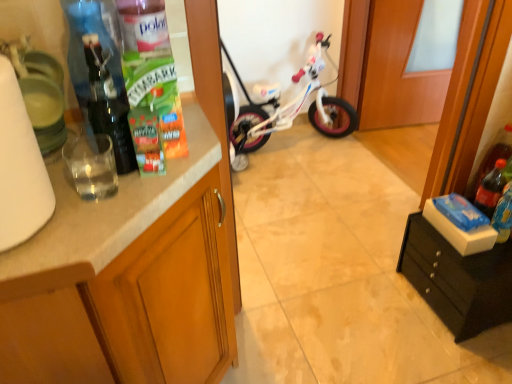
What is the approximate height of wooden door at center?

wooden door at center is 79.51 centimeters in height.

This screenshot has width=512, height=384. I want to click on wooden door at center, so click(x=398, y=71).

What is the approximate height of translucent plastic soda bottle at right, marked as the 2th bottle in a front-to-back arrangement?

translucent plastic soda bottle at right, marked as the 2th bottle in a front-to-back arrangement, is 24.81 centimeters tall.

The width and height of the screenshot is (512, 384). What do you see at coordinates (152, 70) in the screenshot? I see `clear plastic bottle at upper left, the 3th bottle viewed from the right` at bounding box center [152, 70].

Image resolution: width=512 pixels, height=384 pixels. What do you see at coordinates (106, 215) in the screenshot?
I see `white marble countertop at left` at bounding box center [106, 215].

Find the location of a particular element. Image resolution: width=512 pixels, height=384 pixels. matte wood cabinet at left, the second cabinetry in the right-to-left sequence is located at coordinates (121, 259).

From the image's perspective, relative to matte wood cabinet at left, which ranks as the first cabinetry in left-to-right order, is translucent plastic soda bottle at right, arranged as the 2th bottle when viewed from the left, above or below?

Based on their image positions, translucent plastic soda bottle at right, arranged as the 2th bottle when viewed from the left, is located above matte wood cabinet at left, which ranks as the first cabinetry in left-to-right order.

Is translucent plastic soda bottle at right, which is the second bottle from back to front, to the left of matte wood cabinet at left, which ranks as the first cabinetry in left-to-right order, from the viewer's perspective?

Incorrect, translucent plastic soda bottle at right, which is the second bottle from back to front, is not on the left side of matte wood cabinet at left, which ranks as the first cabinetry in left-to-right order.

Who is shorter, translucent plastic soda bottle at right, marked as the 2th bottle in a front-to-back arrangement, or matte wood cabinet at left, which ranks as the first cabinetry in left-to-right order?

translucent plastic soda bottle at right, marked as the 2th bottle in a front-to-back arrangement.

Would you consider wooden door at center to be distant from translucent plastic soda bottle at right, the 1th bottle viewed from the back?

wooden door at center is positioned a significant distance from translucent plastic soda bottle at right, the 1th bottle viewed from the back.

Measure the distance from wooden door at center to translucent plastic soda bottle at right, the 1th bottle viewed from the back.

wooden door at center is 3.82 feet away from translucent plastic soda bottle at right, the 1th bottle viewed from the back.

How many degrees apart are the facing directions of wooden door at center and translucent plastic soda bottle at right, placed as the third bottle when sorted from left to right?

There is a 82-degree angle between the facing directions of wooden door at center and translucent plastic soda bottle at right, placed as the third bottle when sorted from left to right.

Considering the positions of objects wooden door at center and translucent plastic soda bottle at right, positioned as the 3th bottle in front-to-back order, in the image provided, who is more to the left, wooden door at center or translucent plastic soda bottle at right, positioned as the 3th bottle in front-to-back order,?

Positioned to the left is translucent plastic soda bottle at right, positioned as the 3th bottle in front-to-back order.

Is black matte drawer at lower right, positioned as the second cabinetry in left-to-right order, completely or partially inside white glossy bicycle at center?

No.

Which is farther, [357,124] or [415,232]?

The point [357,124] is more distant.

From the image's perspective, which one is positioned higher, white glossy bicycle at center or black matte drawer at lower right, positioned as the second cabinetry in left-to-right order?

white glossy bicycle at center is shown above in the image.

In order to click on bicycle above the black matte drawer at lower right, positioned as the second cabinetry in left-to-right order (from a real-world perspective) in this screenshot , I will do [x=289, y=107].

From the picture: Is black matte drawer at lower right, positioned as the second cabinetry in left-to-right order, further to camera compared to clear plastic bottle at upper left, which is counted as the first bottle, starting from the left?

Yes, black matte drawer at lower right, positioned as the second cabinetry in left-to-right order, is behind clear plastic bottle at upper left, which is counted as the first bottle, starting from the left.

Which is closer to the camera, (487,301) or (165,120)?

The point (165,120) is closer.

Which of these two, black matte drawer at lower right, the first cabinetry from the right, or clear plastic bottle at upper left, which is counted as the first bottle, starting from the left, stands shorter?

black matte drawer at lower right, the first cabinetry from the right, is shorter.

Is black matte drawer at lower right, positioned as the second cabinetry in left-to-right order, spatially inside clear plastic bottle at upper left, which is counted as the third bottle, starting from the back, or outside of it?

black matte drawer at lower right, positioned as the second cabinetry in left-to-right order, is not inside clear plastic bottle at upper left, which is counted as the third bottle, starting from the back, it's outside.

Is white marble countertop at left shorter than matte wood cabinet at left, which ranks as the first cabinetry in left-to-right order?

Indeed, white marble countertop at left has a lesser height compared to matte wood cabinet at left, which ranks as the first cabinetry in left-to-right order.

Considering the positions of points (212, 130) and (179, 237), is point (212, 130) closer to camera compared to point (179, 237)?

That is False.

Can you confirm if white marble countertop at left is positioned to the right of matte wood cabinet at left, which ranks as the first cabinetry in left-to-right order?

Answer: Yes, white marble countertop at left is to the right of matte wood cabinet at left, which ranks as the first cabinetry in left-to-right order.

Is white marble countertop at left looking in the opposite direction of matte wood cabinet at left, which ranks as the first cabinetry in left-to-right order?

No, matte wood cabinet at left, which ranks as the first cabinetry in left-to-right order, is not at the back of white marble countertop at left.

Is blue cardboard box at right in front of or behind matte wood cabinet at left, the second cabinetry in the right-to-left sequence, in the image?

blue cardboard box at right is positioned farther from the viewer than matte wood cabinet at left, the second cabinetry in the right-to-left sequence.

Considering the sizes of blue cardboard box at right and matte wood cabinet at left, the second cabinetry in the right-to-left sequence, in the image, is blue cardboard box at right taller or shorter than matte wood cabinet at left, the second cabinetry in the right-to-left sequence,?

blue cardboard box at right is shorter than matte wood cabinet at left, the second cabinetry in the right-to-left sequence.

In terms of size, does blue cardboard box at right appear bigger or smaller than matte wood cabinet at left, which ranks as the first cabinetry in left-to-right order?

blue cardboard box at right is smaller than matte wood cabinet at left, which ranks as the first cabinetry in left-to-right order.

How distant is white glossy bicycle at center from white marble countertop at left?

white glossy bicycle at center is 1.55 meters from white marble countertop at left.

From the picture: Is white glossy bicycle at center outside of white marble countertop at left?

white glossy bicycle at center lies outside white marble countertop at left's area.

Which object is positioned more to the right, white glossy bicycle at center or white marble countertop at left?

white glossy bicycle at center is more to the right.

Does white glossy bicycle at center have a larger size compared to white marble countertop at left?

Yes.

From a real-world perspective, starting from the matte wood cabinet at left, the second cabinetry in the right-to-left sequence, which bottle is the 1st one vertically above it? Please provide its 2D coordinates.

[(490, 189)]

Starting from the wooden door at center, which bottle is the 1st one in front? Please provide its 2D coordinates.

[(492, 158)]

Considering their positions, is translucent plastic soda bottle at right, which is the second bottle from back to front, positioned further to black matte drawer at lower right, positioned as the second cabinetry in left-to-right order, than white matte paper towel at left?

Among the two, white matte paper towel at left is located further to black matte drawer at lower right, positioned as the second cabinetry in left-to-right order.

Considering their positions, is matte wood cabinet at left, the second cabinetry in the right-to-left sequence, positioned further to wooden door at center than white marble countertop at left?

white marble countertop at left is positioned further to the anchor wooden door at center.

Considering their positions, is translucent plastic soda bottle at right, which is the second bottle from back to front, positioned closer to wooden door at center than white matte paper towel at left?

Among the two, translucent plastic soda bottle at right, which is the second bottle from back to front, is located nearer to wooden door at center.

Looking at the image, which one is located closer to translucent plastic soda bottle at right, the 1th bottle viewed from the back, blue cardboard box at right or wooden door at center?

Based on the image, blue cardboard box at right appears to be nearer to translucent plastic soda bottle at right, the 1th bottle viewed from the back.

Considering their positions, is blue cardboard box at right positioned further to black matte drawer at lower right, the first cabinetry from the right, than white marble countertop at left?

white marble countertop at left lies further to black matte drawer at lower right, the first cabinetry from the right, than the other object.

Estimate the real-world distances between objects in this image. Which object is closer to white marble countertop at left, translucent plastic soda bottle at right, positioned as the 3th bottle in front-to-back order, or clear plastic bottle at upper left, the 3th bottle viewed from the right?

Based on the image, clear plastic bottle at upper left, the 3th bottle viewed from the right, appears to be nearer to white marble countertop at left.

Looking at the image, which one is located further to blue cardboard box at right, translucent plastic soda bottle at right, which is the second bottle from right to left, or clear plastic bottle at upper left, which is counted as the first bottle, starting from the left?

The object further to blue cardboard box at right is clear plastic bottle at upper left, which is counted as the first bottle, starting from the left.

From the picture: Estimate the real-world distances between objects in this image. Which object is closer to clear plastic bottle at upper left, positioned as the 1th bottle in front-to-back order, wooden door at center or matte wood cabinet at left, the second cabinetry in the right-to-left sequence?

matte wood cabinet at left, the second cabinetry in the right-to-left sequence, is positioned closer to the anchor clear plastic bottle at upper left, positioned as the 1th bottle in front-to-back order.

Locate an element on the screen. Image resolution: width=512 pixels, height=384 pixels. bottle situated between white marble countertop at left and black matte drawer at lower right, the first cabinetry from the right, from left to right is located at coordinates (152, 70).

At what (x,y) coordinates should I click in order to perform the action: click on cabinetry between matte wood cabinet at left, which ranks as the first cabinetry in left-to-right order, and wooden door at center in the front-back direction. Please return your answer as a coordinate pair (x, y). The width and height of the screenshot is (512, 384). Looking at the image, I should click on (457, 279).

Where is `box between white glossy bicycle at center and black matte drawer at lower right, positioned as the second cabinetry in left-to-right order, from top to bottom`? box between white glossy bicycle at center and black matte drawer at lower right, positioned as the second cabinetry in left-to-right order, from top to bottom is located at coordinates (460, 224).

Where is `box between matte wood cabinet at left, which ranks as the first cabinetry in left-to-right order, and translucent plastic soda bottle at right, marked as the first bottle in a right-to-left arrangement`? Image resolution: width=512 pixels, height=384 pixels. box between matte wood cabinet at left, which ranks as the first cabinetry in left-to-right order, and translucent plastic soda bottle at right, marked as the first bottle in a right-to-left arrangement is located at coordinates (460, 224).